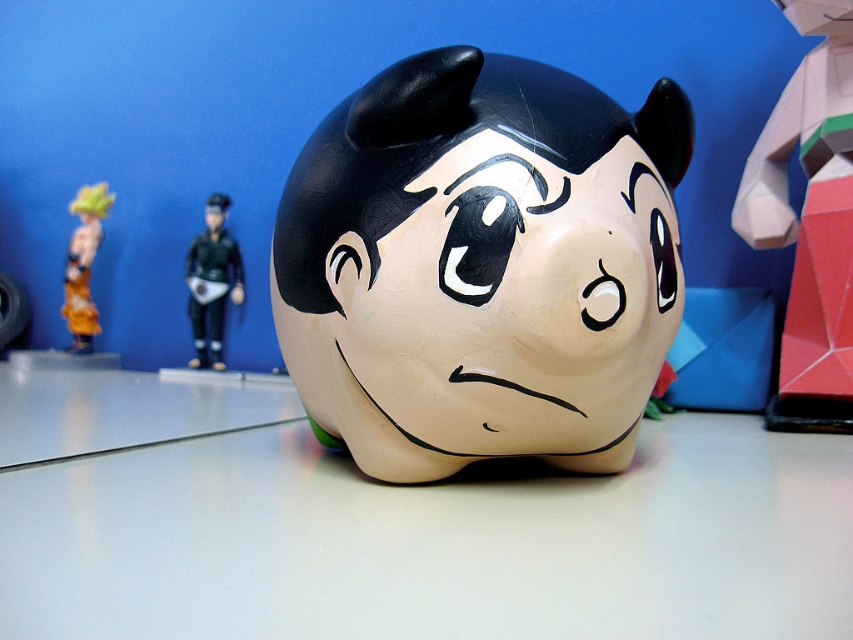
From the picture: You are a collector arranging items on a shelf. You have a matte black face at center and a black matte figure at left. According to the scene, which item is positioned lower on the shelf?

The matte black face at center is located below the black matte figure at left, so it is positioned lower on the shelf.

You are an interior designer arranging items on a shelf. You have the geometric paper model at right and the black matte figure at left. Based on the scene, which object is positioned higher on the shelf?

The geometric paper model at right is positioned higher on the shelf than the black matte figure at left because it is described as being above it.

Consider the image. You are standing in front of the piggy bank and want to place a new sticker on the closest object. Which object should you choose between the matte black face at center and the black matte figure at left?

The matte black face at center is closer to the viewer than the black matte figure at left, so you should choose the matte black face at center to place the sticker.